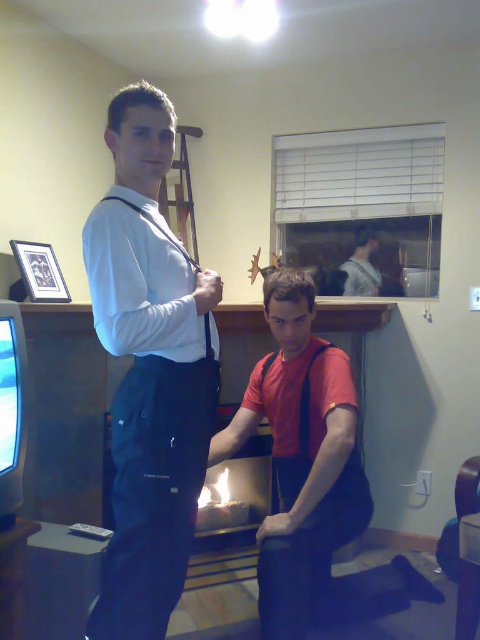
You are a fashion designer observing the two individuals in the image. You need to determine the layering order of their clothing items. Which clothing item is layered over the other between the smooth gray shirt at center and the matte black suspenders at upper left?

The smooth gray shirt at center is positioned over the matte black suspenders at upper left, meaning the shirt is layered on top of the suspenders.

You are standing in the living room and see two points marked in the image. Which point is closer to you, point (183, 384) or point (208, 330)?

Point (183, 384) is in front of point (208, 330), so it is closer to you.

You are trying to decide which item to pack for a trip. You can only choose one between the smooth gray shirt at center and the matte black suspenders at upper left. If you want to take the smaller item, which one should you choose?

The smooth gray shirt at center is smaller than the matte black suspenders at upper left, so you should choose the smooth gray shirt at center.